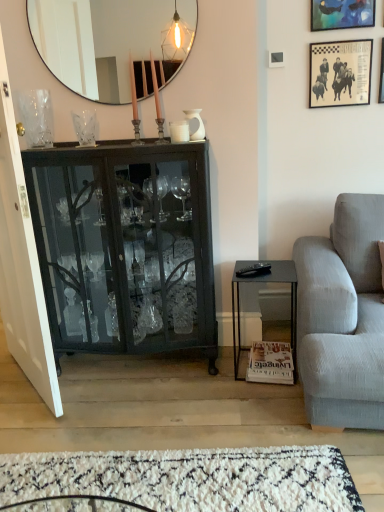
Where is `free region on the left part of black metal side table at lower right`? free region on the left part of black metal side table at lower right is located at coordinates (212, 373).